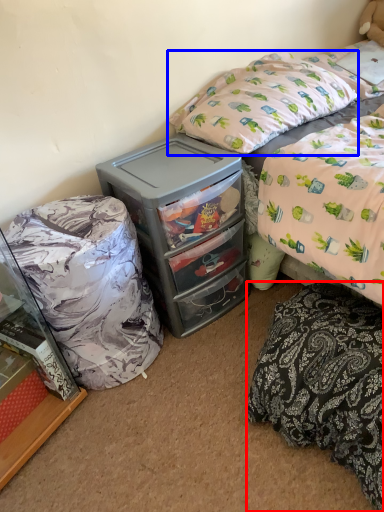
Question: Among these objects, which one is farthest to the camera, mattress (highlighted by a red box) or pillow (highlighted by a blue box)?

Choices:
 (A) mattress
 (B) pillow

Answer: (B)